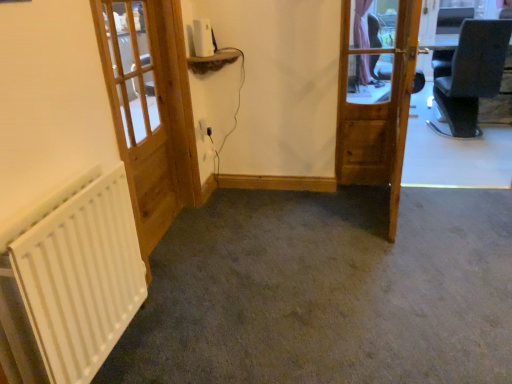
Question: Would you say white matte radiator at lower left is to the left or to the right of white plastic electric outlet at center in the picture?

Choices:
 (A) left
 (B) right

Answer: (A)

Question: Considering the positions of white matte radiator at lower left and white plastic electric outlet at center in the image, is white matte radiator at lower left bigger or smaller than white plastic electric outlet at center?

Choices:
 (A) big
 (B) small

Answer: (A)

Question: Estimate the real-world distances between objects in this image. Which object is closer to the white plastic electric outlet at center?

Choices:
 (A) white wooden door at left, marked as the second door in a right-to-left arrangement
 (B) wooden door at center, the first door from the right
 (C) white matte radiator at lower left

Answer: (A)

Question: Based on their relative distances, which object is farther from the white wooden door at left, marked as the second door in a right-to-left arrangement?

Choices:
 (A) wooden door at center, the first door from the right
 (B) white matte radiator at lower left
 (C) white plastic electric outlet at center

Answer: (A)